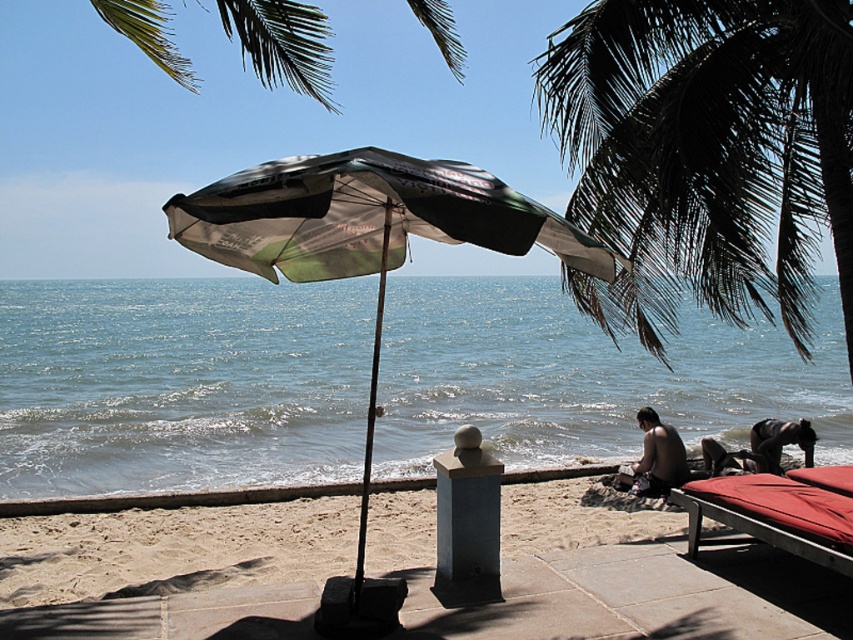
Does green leafy palm tree at upper center have a greater height compared to dark brown leather bag at lower right?

Yes, green leafy palm tree at upper center is taller than dark brown leather bag at lower right.

Describe the element at coordinates (283, 44) in the screenshot. I see `green leafy palm tree at upper center` at that location.

Is point (244, 61) closer to camera compared to point (811, 444)?

No, it is behind (811, 444).

I want to click on green leafy palm tree at upper center, so click(283, 44).

Who is higher up, matte black umbrella at center or green leafy palm tree at upper center?

green leafy palm tree at upper center is above.

Is matte black umbrella at center further to camera compared to green leafy palm tree at upper center?

No, it is not.

Where is `matte black umbrella at center`? The image size is (853, 640). matte black umbrella at center is located at coordinates (604, 577).

Identify the location of matte black umbrella at center. (x=604, y=577).

Is blue water at center positioned behind printed fabric umbrella at center?

Yes, blue water at center is further from the viewer.

Between blue water at center and printed fabric umbrella at center, which one is positioned lower?

printed fabric umbrella at center is lower down.

Does point (460, 362) lie behind point (311, 241)?

Yes, it is behind point (311, 241).

The height and width of the screenshot is (640, 853). I want to click on blue water at center, so click(x=180, y=384).